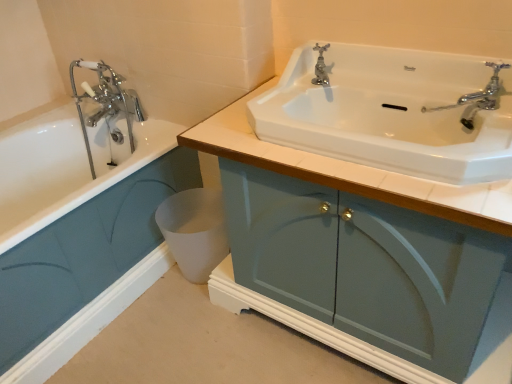
Question: Would you say matte teal cabinet at lower left, the 1th bathroom cabinet positioned from the left, contains white matte toilet bowl at lower center?

Choices:
 (A) no
 (B) yes

Answer: (A)

Question: From a real-world perspective, is matte teal cabinet at lower left, the 1th bathroom cabinet positioned from the left, on top of white matte toilet bowl at lower center?

Choices:
 (A) yes
 (B) no

Answer: (A)

Question: Does matte teal cabinet at lower left, the 2th bathroom cabinet positioned from the right, have a lesser height compared to white matte toilet bowl at lower center?

Choices:
 (A) no
 (B) yes

Answer: (A)

Question: Is matte teal cabinet at lower left, the 2th bathroom cabinet positioned from the right, looking in the opposite direction of white matte toilet bowl at lower center?

Choices:
 (A) yes
 (B) no

Answer: (B)

Question: From the image's perspective, would you say matte teal cabinet at lower left, the 1th bathroom cabinet positioned from the left, is positioned over white matte toilet bowl at lower center?

Choices:
 (A) no
 (B) yes

Answer: (B)

Question: Relative to polished chrome faucet at upper center, is white matte toilet bowl at lower center in front or behind?

Choices:
 (A) front
 (B) behind

Answer: (B)

Question: Does point (220, 190) appear closer or farther from the camera than point (324, 82)?

Choices:
 (A) farther
 (B) closer

Answer: (A)

Question: Looking at the image, does white matte toilet bowl at lower center seem bigger or smaller compared to polished chrome faucet at upper center?

Choices:
 (A) big
 (B) small

Answer: (A)

Question: Choose the correct answer: Is white matte toilet bowl at lower center inside polished chrome faucet at upper center or outside it?

Choices:
 (A) outside
 (B) inside

Answer: (A)

Question: From their relative heights in the image, would you say polished chrome faucet at upper center is taller or shorter than matte blue cabinet at center, positioned as the 1th bathroom cabinet in right-to-left order?

Choices:
 (A) short
 (B) tall

Answer: (A)

Question: Visually, is polished chrome faucet at upper center positioned to the left or to the right of matte blue cabinet at center, positioned as the 1th bathroom cabinet in right-to-left order?

Choices:
 (A) right
 (B) left

Answer: (B)

Question: Is point (315, 77) closer or farther from the camera than point (360, 350)?

Choices:
 (A) farther
 (B) closer

Answer: (A)

Question: In terms of size, does polished chrome faucet at upper center appear bigger or smaller than matte blue cabinet at center, positioned as the 1th bathroom cabinet in right-to-left order?

Choices:
 (A) small
 (B) big

Answer: (A)

Question: Looking at their shapes, would you say matte teal cabinet at lower left, the 2th bathroom cabinet positioned from the right, is wider or thinner than white matte toilet bowl at lower center?

Choices:
 (A) wide
 (B) thin

Answer: (A)

Question: Which is correct: matte teal cabinet at lower left, the 1th bathroom cabinet positioned from the left, is inside white matte toilet bowl at lower center, or outside of it?

Choices:
 (A) inside
 (B) outside

Answer: (B)